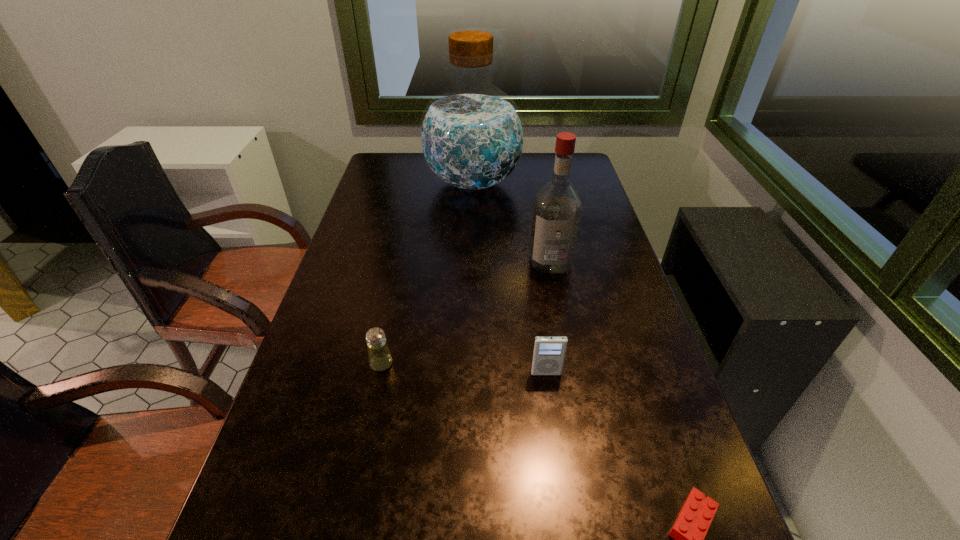
Identify which object is located as the fourth nearest to the iPod. Please provide its 2D coordinates. Your answer should be formatted as a tuple, i.e. [(x, y)], where the tuple contains the x and y coordinates of a point satisfying the conditions above.

[(471, 135)]

Identify the location of the fourth closest object to the second tallest object. This screenshot has height=540, width=960. (690, 528).

This screenshot has width=960, height=540. What are the coordinates of `vacant space that satisfies the following two spatial constraints: 1. on the back side of the tallest object; 2. on the right side of the saltshaker` in the screenshot? It's located at (420, 183).

You are a GUI agent. You are given a task and a screenshot of the screen. Output one action in this format:
    pyautogui.click(x=<x>, y=<y>)
    Task: Click on the free point that satisfies the following two spatial constraints: 1. on the back side of the tallest object; 2. on the right side of the saltshaker
    This screenshot has height=540, width=960.
    Given the screenshot: What is the action you would take?
    pyautogui.click(x=420, y=183)